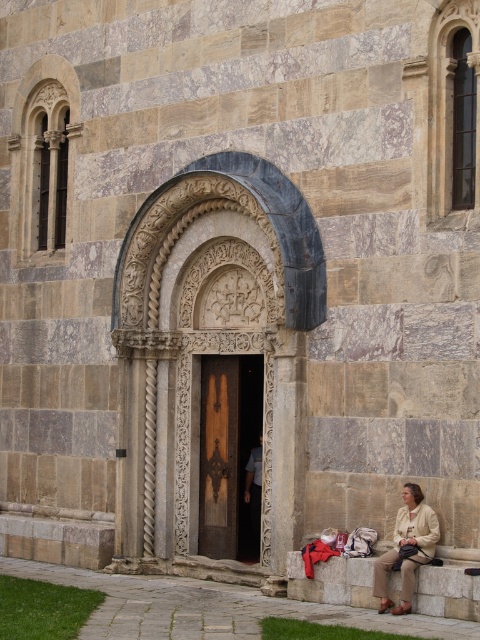
Question: Can you confirm if beige fabric jacket at lower right is positioned to the right of dark brown wood door at center?

Choices:
 (A) no
 (B) yes

Answer: (B)

Question: In this image, where is beige fabric jacket at lower right located relative to dark brown wood door at center?

Choices:
 (A) above
 (B) below

Answer: (A)

Question: Which object appears closest to the camera in this image?

Choices:
 (A) dark brown wood door at center
 (B) beige fabric jacket at lower right

Answer: (B)

Question: Which point is farther to the camera?

Choices:
 (A) (255, 472)
 (B) (380, 612)

Answer: (A)

Question: Is beige fabric jacket at lower right positioned at the back of dark brown wood door at center?

Choices:
 (A) no
 (B) yes

Answer: (A)